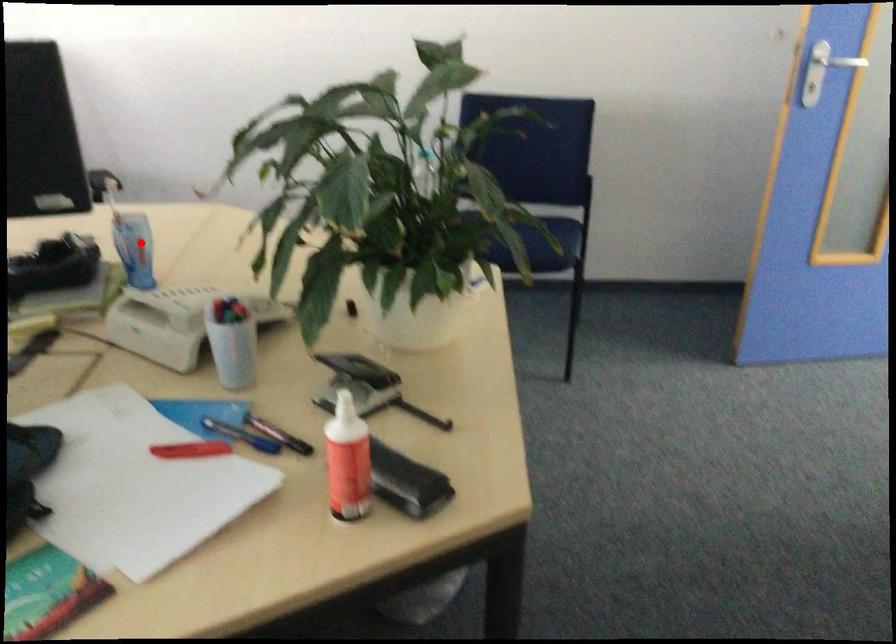
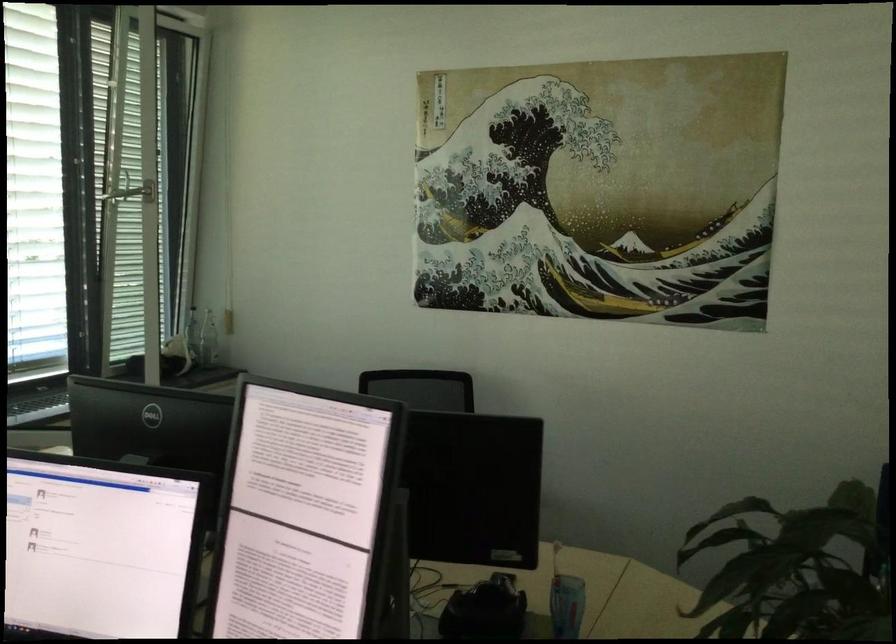
Locate, in the second image, the point that corresponds to the highlighted location in the first image.

(566, 605)